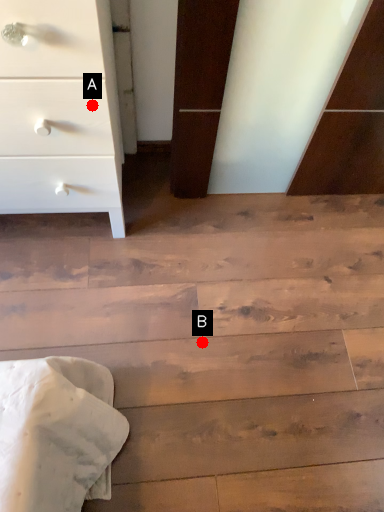
Question: Two points are circled on the image, labeled by A and B beside each circle. Which point is closer to the camera?

Choices:
 (A) A is closer
 (B) B is closer

Answer: (A)